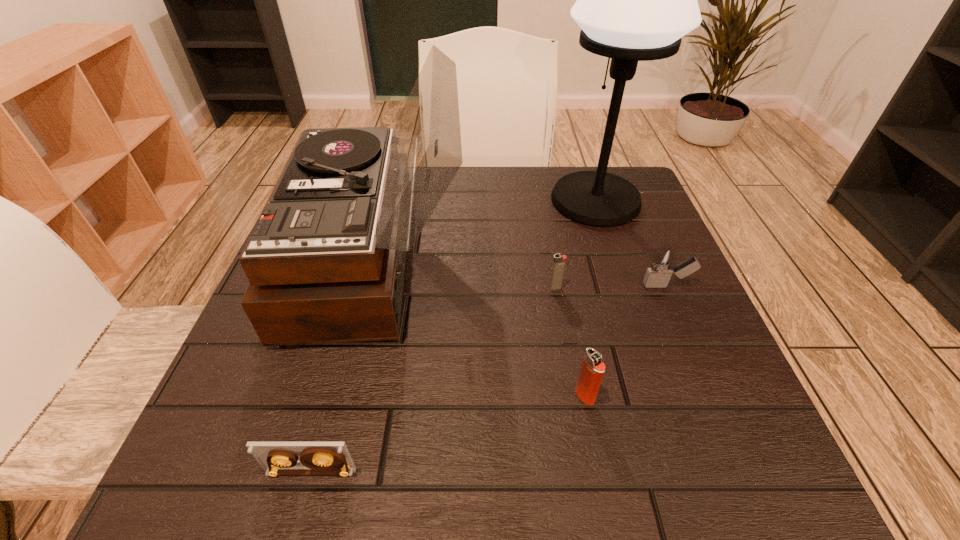
You are a GUI agent. You are given a task and a screenshot of the screen. Output one action in this format:
    pyautogui.click(x=<x>, y=<y>)
    Task: Click on the record player that is at the far edge
    This screenshot has height=540, width=960.
    Given the screenshot: What is the action you would take?
    pyautogui.click(x=326, y=259)

Locate an element on the screen. object present at the near edge is located at coordinates (277, 458).

Identify the location of record player that is at the left edge. The image size is (960, 540). 326,259.

What are the coordinates of `videotape situated at the left edge` in the screenshot? It's located at (277, 458).

What are the coordinates of `table lamp present at the right edge` in the screenshot? It's located at (635, 0).

This screenshot has height=540, width=960. Identify the location of igniter at the right edge. pos(662,265).

This screenshot has width=960, height=540. Find the location of `object situated at the far left corner`. object situated at the far left corner is located at coordinates (326, 259).

Find the location of `object located in the near left corner section of the desktop`. object located in the near left corner section of the desktop is located at coordinates (277, 458).

You are a GUI agent. You are given a task and a screenshot of the screen. Output one action in this format:
    pyautogui.click(x=<x>, y=<y>)
    Task: Click on the object at the far right corner
    This screenshot has width=960, height=540.
    Given the screenshot: What is the action you would take?
    pyautogui.click(x=635, y=0)

In the image, there is a desktop. Identify the location of vacant space at the far edge. The width and height of the screenshot is (960, 540). (537, 202).